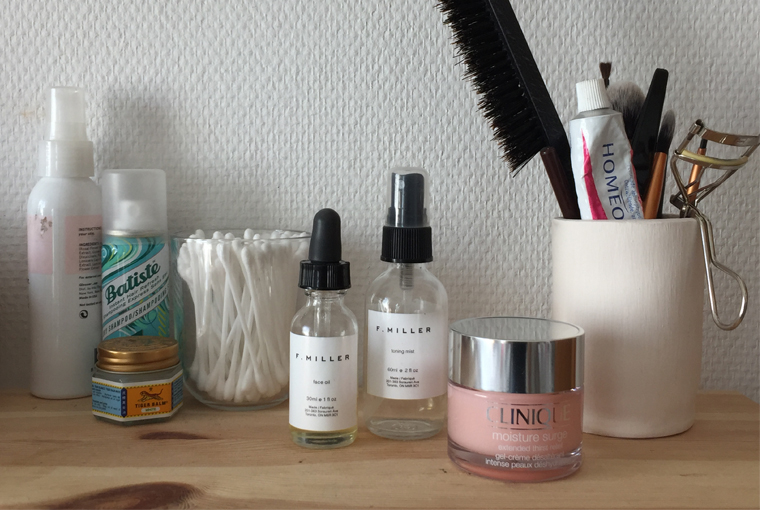
Find the location of a particular element. This screenshot has width=760, height=510. bottles is located at coordinates (68, 275), (133, 284), (325, 348), (422, 336).